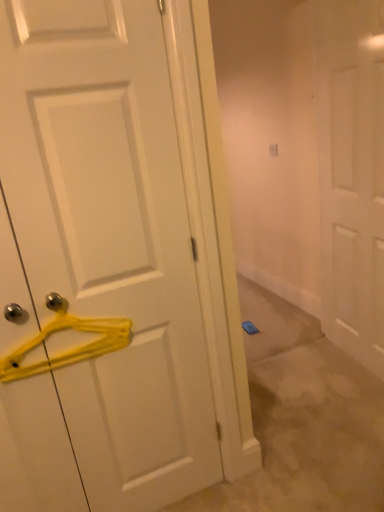
Locate an element on the screen. yellow plastic hanger at left is located at coordinates (71, 349).

This screenshot has height=512, width=384. In order to click on white matte door at left, which is counted as the first door, starting from the left in this screenshot , I will do `click(99, 261)`.

Identify the location of yellow plastic hanger at left. The height and width of the screenshot is (512, 384). (71, 349).

From the image's perspective, is white matte door at left, the second door positioned from the right, beneath yellow plastic hanger at left?

No, from the image's perspective, white matte door at left, the second door positioned from the right, is not below yellow plastic hanger at left.

Which is more to the right, white matte door at left, the second door positioned from the right, or yellow plastic hanger at left?

From the viewer's perspective, white matte door at left, the second door positioned from the right, appears more on the right side.

Can we say white matte door at left, which is counted as the first door, starting from the left, lies outside yellow plastic hanger at left?

That's correct, white matte door at left, which is counted as the first door, starting from the left, is outside of yellow plastic hanger at left.

Between yellow plastic hanger at left and white matte door at left, the second door positioned from the right, which one is positioned in front?

white matte door at left, the second door positioned from the right.

From the image's perspective, is yellow plastic hanger at left above or below white matte door at left, the second door positioned from the right?

From the image's perspective, yellow plastic hanger at left appears below white matte door at left, the second door positioned from the right.

Is yellow plastic hanger at left bigger than white matte door at left, acting as the 1th door starting from the front?

No, yellow plastic hanger at left is not bigger than white matte door at left, acting as the 1th door starting from the front.

Is point (45, 369) behind point (165, 394)?

No, (45, 369) is in front of (165, 394).

At what (x,y) coordinates should I click in order to perform the action: click on door on the right of white matte door at left, acting as the 1th door starting from the front. Please return your answer as a coordinate pair (x, y). Image resolution: width=384 pixels, height=512 pixels. Looking at the image, I should click on (352, 174).

Which of these two, white matte door at center, the first door positioned from the back, or white matte door at left, the second door positioned from the right, stands shorter?

With less height is white matte door at left, the second door positioned from the right.

From the picture: How much distance is there between white matte door at center, the 2th door viewed from the front, and white matte door at left, which is counted as the first door, starting from the left?

white matte door at center, the 2th door viewed from the front, and white matte door at left, which is counted as the first door, starting from the left, are 1.23 meters apart from each other.

Looking at this image, is white matte door at center, the first door positioned from the back, oriented towards white matte door at left, which appears as the 2th door when viewed from the back?

No.

Which object is further away from the camera taking this photo, yellow plastic hanger at left or white matte door at center, the first door positioned from the back?

white matte door at center, the first door positioned from the back, is more distant.

Can you see yellow plastic hanger at left touching white matte door at center, which is the second door in left-to-right order?

yellow plastic hanger at left and white matte door at center, which is the second door in left-to-right order, are clearly separated.

From the image's perspective, which is below, yellow plastic hanger at left or white matte door at center, the first door positioned from the back?

From the image's view, yellow plastic hanger at left is below.

From a real-world perspective, between yellow plastic hanger at left and white matte door at center, the 2th door viewed from the front, who is vertically higher?

In real-world perspective, white matte door at center, the 2th door viewed from the front, is above.

How distant is white matte door at left, which appears as the 2th door when viewed from the back, from white matte door at center, which is the second door in left-to-right order?

They are 4.02 feet apart.

Considering the sizes of objects white matte door at left, the second door positioned from the right, and white matte door at center, the first door positioned from the back, in the image provided, who is smaller, white matte door at left, the second door positioned from the right, or white matte door at center, the first door positioned from the back,?

With smaller size is white matte door at left, the second door positioned from the right.

Is white matte door at left, which is counted as the first door, starting from the left, surrounding white matte door at center, the first door positioned from the back?

Actually, white matte door at center, the first door positioned from the back, is outside white matte door at left, which is counted as the first door, starting from the left.

Does point (159, 143) lie behind point (344, 42)?

No.

Considering the relative positions of white matte door at center, the first door positioned from the back, and yellow plastic hanger at left in the image provided, is white matte door at center, the first door positioned from the back, to the right of yellow plastic hanger at left from the viewer's perspective?

Indeed, white matte door at center, the first door positioned from the back, is positioned on the right side of yellow plastic hanger at left.

Is point (359, 104) behind point (15, 361)?

That is True.

From the image's perspective, is white matte door at center, the first door positioned from the back, on top of yellow plastic hanger at left?

Yes.

Between white matte door at center, the 2th door viewed from the front, and yellow plastic hanger at left, which one has larger size?

With larger size is white matte door at center, the 2th door viewed from the front.

Locate an element on the screen. the 1st door above when counting from the yellow plastic hanger at left (from the image's perspective) is located at coordinates (99, 261).

The height and width of the screenshot is (512, 384). Identify the location of hanger that is behind the white matte door at left, which is counted as the first door, starting from the left. (71, 349).

Looking at the image, which one is located further to white matte door at left, which is counted as the first door, starting from the left, yellow plastic hanger at left or white matte door at center, the first door positioned from the back?

white matte door at center, the first door positioned from the back, is positioned further to the anchor white matte door at left, which is counted as the first door, starting from the left.

Estimate the real-world distances between objects in this image. Which object is further from white matte door at center, the 1th door from the right, white matte door at left, acting as the 1th door starting from the front, or yellow plastic hanger at left?

yellow plastic hanger at left.

Based on their spatial positions, is white matte door at center, the 1th door from the right, or yellow plastic hanger at left further from white matte door at left, acting as the 1th door starting from the front?

white matte door at center, the 1th door from the right, is further to white matte door at left, acting as the 1th door starting from the front.

Which object lies nearer to the anchor point yellow plastic hanger at left, white matte door at left, which is counted as the first door, starting from the left, or white matte door at center, the 2th door viewed from the front?

Based on the image, white matte door at left, which is counted as the first door, starting from the left, appears to be nearer to yellow plastic hanger at left.

Which object lies further to the anchor point yellow plastic hanger at left, white matte door at center, which is the second door in left-to-right order, or white matte door at left, acting as the 1th door starting from the front?

Among the two, white matte door at center, which is the second door in left-to-right order, is located further to yellow plastic hanger at left.

Looking at the image, which one is located closer to white matte door at center, the 1th door from the right, yellow plastic hanger at left or white matte door at left, acting as the 1th door starting from the front?

white matte door at left, acting as the 1th door starting from the front, lies closer to white matte door at center, the 1th door from the right, than the other object.

Identify the location of door between yellow plastic hanger at left and white matte door at center, the 2th door viewed from the front. The image size is (384, 512). (99, 261).